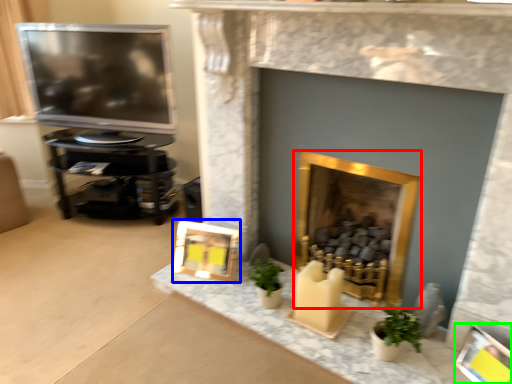
Question: Based on their relative distances, which object is farther from fireplace (highlighted by a red box)? Choose from picture frame (highlighted by a blue box) and picture frame (highlighted by a green box).

Choices:
 (A) picture frame
 (B) picture frame

Answer: (B)